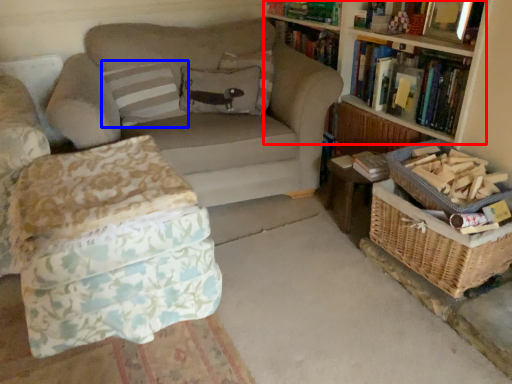
Question: Which object is closer to the camera taking this photo, bookcase (highlighted by a red box) or pillow (highlighted by a blue box)?

Choices:
 (A) bookcase
 (B) pillow

Answer: (A)